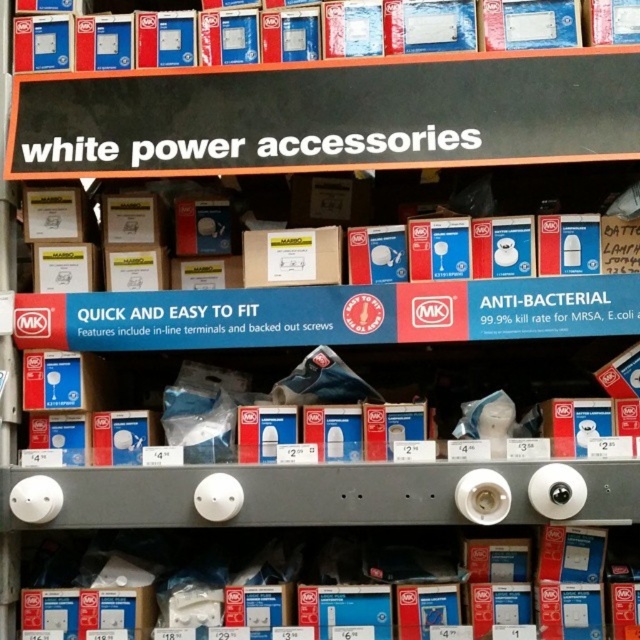
You are a customer standing in front of the retail store shelf. You see two points marked on the shelf. Which point is closer to you, point (x=125, y=177) or point (x=289, y=236)?

Point (x=125, y=177) is in front of point (x=289, y=236), so it is closer to you.

You are a store employee trying to restock the shelf. You have a new white cardboard box at center that you need to place between the existing white cardboard boxes at center. Can you fit it there without moving any existing boxes?

The white cardboard boxes at center might be wider than the white cardboard box at center, so there may not be enough space to fit the new box without moving existing boxes.

You are an interior designer who needs to place a decorative item between the white plastic light bulb at center and the white cardboard boxes at center on the retail store shelf. The decorative item is 20 centimeters wide. Will there be enough space between them to fit the item?

The distance between the white plastic light bulb at center and the white cardboard boxes at center is 30.61 centimeters. Since the decorative item is 20 centimeters wide, there is sufficient space to fit it between them.